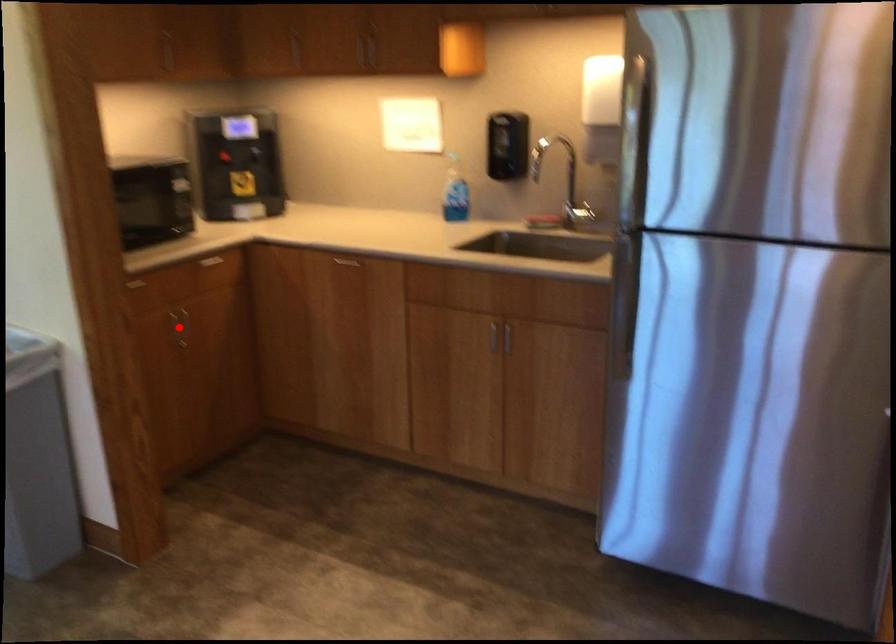
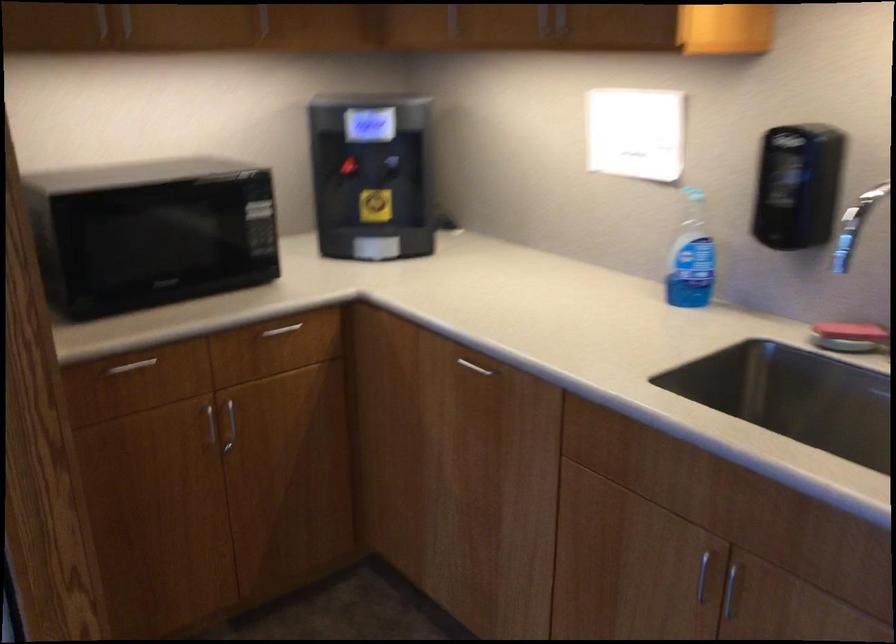
Question: I am providing you with two images of the same scene from different viewpoints. A red point is shown in image1. For the corresponding object point in image2, is it positioned nearer or farther from the camera?

Choices:
 (A) Nearer
 (B) Farther

Answer: (A)